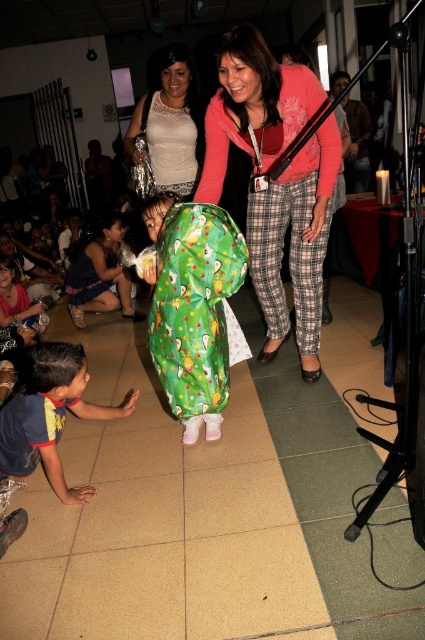
The image size is (425, 640). Describe the element at coordinates (275, 180) in the screenshot. I see `pink soft sweater at center` at that location.

Can you confirm if pink soft sweater at center is positioned above green shiny wrapping paper at center?

Yes.

What do you see at coordinates (275, 180) in the screenshot?
I see `pink soft sweater at center` at bounding box center [275, 180].

What are the coordinates of `pink soft sweater at center` in the screenshot? It's located at (275, 180).

Is green shiny wrapping paper at center positioned behind white lace dress at upper center?

No, green shiny wrapping paper at center is closer to the viewer.

Can you confirm if green shiny wrapping paper at center is positioned above white lace dress at upper center?

No, green shiny wrapping paper at center is not above white lace dress at upper center.

Identify the location of green shiny wrapping paper at center. This screenshot has height=640, width=425. (195, 307).

Does pink soft sweater at center have a lesser width compared to blue cotton shirt at lower left?

Incorrect, pink soft sweater at center's width is not less than blue cotton shirt at lower left's.

Who is more forward, (238, 116) or (34, 378)?

Point (34, 378) is in front.

Is point (300, 362) positioned after point (31, 387)?

Yes, it is behind point (31, 387).

You are a GUI agent. You are given a task and a screenshot of the screen. Output one action in this format:
    pyautogui.click(x=<x>, y=<y>)
    Task: Click on the pink soft sweater at center
    This screenshot has width=425, height=640.
    Given the screenshot: What is the action you would take?
    pyautogui.click(x=275, y=180)